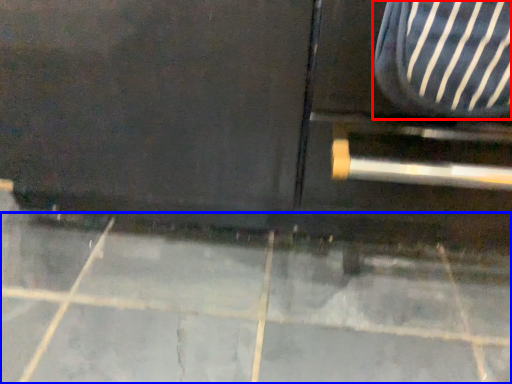
Question: Which point is further to the camera, armchair (highlighted by a red box) or concrete (highlighted by a blue box)?

Choices:
 (A) armchair
 (B) concrete

Answer: (B)